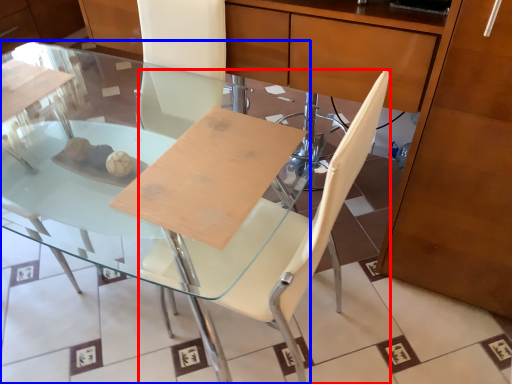
Question: Which object is further to the camera taking this photo, chair (highlighted by a red box) or table (highlighted by a blue box)?

Choices:
 (A) chair
 (B) table

Answer: (B)